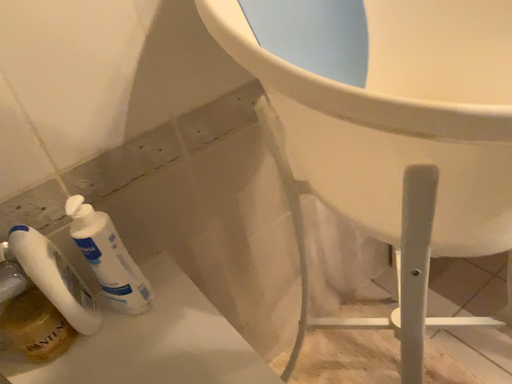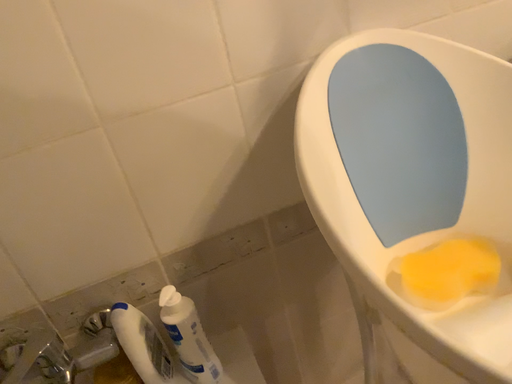
Question: How did the camera likely rotate when shooting the video?

Choices:
 (A) rotated right
 (B) rotated left

Answer: (B)